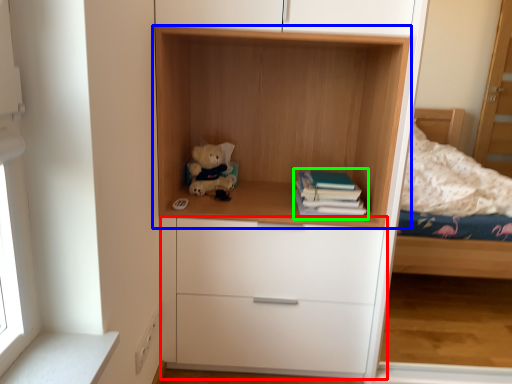
Question: Which object is the closest to the chest of drawers (highlighted by a red box)? Choose among these: shelf (highlighted by a blue box) or paperback book (highlighted by a green box).

Choices:
 (A) shelf
 (B) paperback book

Answer: (B)